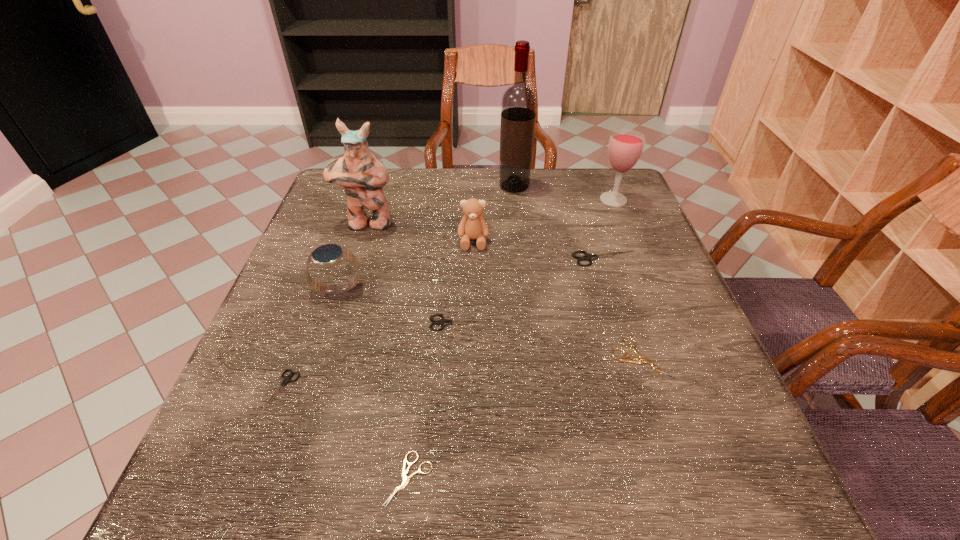
The height and width of the screenshot is (540, 960). I want to click on object located in the near edge section of the desktop, so click(x=405, y=479).

At what (x,y) coordinates should I click in order to perform the action: click on figurine positioned at the left edge. Please return your answer as a coordinate pair (x, y). This screenshot has width=960, height=540. Looking at the image, I should click on (x=362, y=175).

Where is `watch at the left edge`? watch at the left edge is located at coordinates (328, 255).

Find the location of a particular element. shears located in the left edge section of the desktop is located at coordinates (287, 379).

Identify the location of wineglass present at the right edge. This screenshot has height=540, width=960. click(625, 147).

Find the location of a particular element. object present at the far right corner is located at coordinates (625, 147).

Locate an element on the screen. free space at the far edge is located at coordinates (492, 173).

In the image, there is a desktop. Where is `free region at the near edge`? This screenshot has height=540, width=960. free region at the near edge is located at coordinates (337, 472).

This screenshot has height=540, width=960. What are the coordinates of `vacant position at the left edge of the desktop` in the screenshot? It's located at (330, 234).

Locate an element on the screen. The width and height of the screenshot is (960, 540). free space at the right edge is located at coordinates (644, 377).